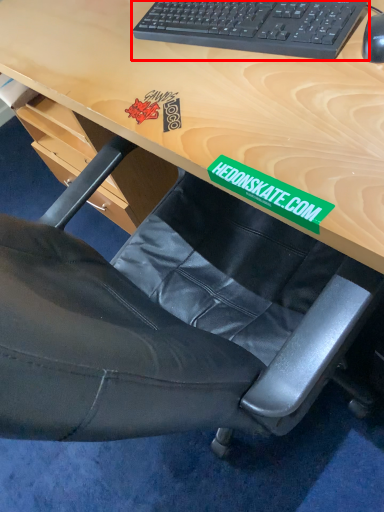
Question: From the image's perspective, where is computer keyboard (annotated by the red box) located relative to mouse?

Choices:
 (A) below
 (B) above

Answer: (B)